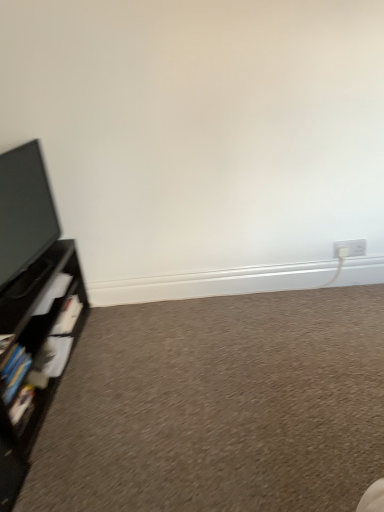
What do you see at coordinates (349, 248) in the screenshot? The width and height of the screenshot is (384, 512). I see `white plastic electric outlet at lower right` at bounding box center [349, 248].

Image resolution: width=384 pixels, height=512 pixels. What do you see at coordinates (41, 298) in the screenshot?
I see `black matte shelf at left` at bounding box center [41, 298].

What do you see at coordinates (218, 407) in the screenshot? Image resolution: width=384 pixels, height=512 pixels. I see `carpet at lower left` at bounding box center [218, 407].

The image size is (384, 512). I want to click on white plastic electric outlet at lower right, so click(349, 248).

Consider the image. Would you say white plastic electric outlet at lower right is a long distance from carpet at lower left?

Actually, white plastic electric outlet at lower right and carpet at lower left are a little close together.

Can you tell me how much white plastic electric outlet at lower right and carpet at lower left differ in facing direction?

They differ by 89.8 degrees in their facing directions.

Considering the points (354, 255) and (357, 369), which point is in front, point (354, 255) or point (357, 369)?

The point (357, 369) is closer to the camera.

Is white plastic electric outlet at lower right wider than carpet at lower left?

Incorrect, the width of white plastic electric outlet at lower right does not surpass that of carpet at lower left.

Who is more distant, black matte shelf at left or white plastic electric outlet at lower right?

white plastic electric outlet at lower right is further away from the camera.

How distant is black matte shelf at left from white plastic electric outlet at lower right?

black matte shelf at left and white plastic electric outlet at lower right are 4.44 feet apart from each other.

From a real-world perspective, is black matte shelf at left positioned over white plastic electric outlet at lower right based on gravity?

Actually, black matte shelf at left is physically below white plastic electric outlet at lower right in the real world.

Which is more to the right, black matte shelf at left or white plastic electric outlet at lower right?

white plastic electric outlet at lower right is more to the right.

Choose the correct answer: Is carpet at lower left inside black matte shelf at left or outside it?

carpet at lower left is located beyond the bounds of black matte shelf at left.

In terms of height, does carpet at lower left look taller or shorter compared to black matte shelf at left?

Clearly, carpet at lower left is shorter compared to black matte shelf at left.

Does point (360, 393) come in front of point (36, 319)?

Yes, point (360, 393) is in front of point (36, 319).

From a real-world perspective, which object stands above the other?

In real-world perspective, black matte shelf at left is above.

Is black matte shelf at left far away from carpet at lower left?

No, black matte shelf at left is not far from carpet at lower left.

Based on the photo, from the image's perspective, which is above, black matte shelf at left or carpet at lower left?

Answer: black matte shelf at left, from the image's perspective.

Who is bigger, white plastic electric outlet at lower right or black matte shelf at left?

black matte shelf at left is bigger.

From the image's perspective, which one is positioned lower, white plastic electric outlet at lower right or black matte shelf at left?

From the image's view, black matte shelf at left is below.

Between white plastic electric outlet at lower right and black matte shelf at left, which one appears on the left side from the viewer's perspective?

Positioned to the left is black matte shelf at left.

Which object is closer to the camera, white plastic electric outlet at lower right or black matte shelf at left?

black matte shelf at left.

Does carpet at lower left come in front of white plastic electric outlet at lower right?

Yes, carpet at lower left is in front of white plastic electric outlet at lower right.

From a real-world perspective, is carpet at lower left physically below white plastic electric outlet at lower right?

Yes.

Who is smaller, carpet at lower left or white plastic electric outlet at lower right?

white plastic electric outlet at lower right is smaller.

Is carpet at lower left spatially inside white plastic electric outlet at lower right, or outside of it?

carpet at lower left lies outside white plastic electric outlet at lower right.

Identify the location of electric outlet that appears behind the carpet at lower left. The image size is (384, 512). (349, 248).

Identify the location of electric outlet above the black matte shelf at left (from a real-world perspective). The height and width of the screenshot is (512, 384). (349, 248).

When comparing their distances from black matte shelf at left, does carpet at lower left or white plastic electric outlet at lower right seem further?

white plastic electric outlet at lower right is positioned further to the anchor black matte shelf at left.

Looking at the image, which one is located further to white plastic electric outlet at lower right, carpet at lower left or black matte shelf at left?

black matte shelf at left.

Based on their spatial positions, is black matte shelf at left or white plastic electric outlet at lower right further from carpet at lower left?

white plastic electric outlet at lower right lies further to carpet at lower left than the other object.

Based on their spatial positions, is white plastic electric outlet at lower right or carpet at lower left further from black matte shelf at left?

white plastic electric outlet at lower right.

Considering their positions, is black matte shelf at left positioned closer to white plastic electric outlet at lower right than carpet at lower left?

carpet at lower left is closer to white plastic electric outlet at lower right.

Looking at the image, which one is located further to carpet at lower left, white plastic electric outlet at lower right or black matte shelf at left?

The object further to carpet at lower left is white plastic electric outlet at lower right.

Find the location of a particular element. This screenshot has width=384, height=512. plain between black matte shelf at left and white plastic electric outlet at lower right in the horizontal direction is located at coordinates (218, 407).